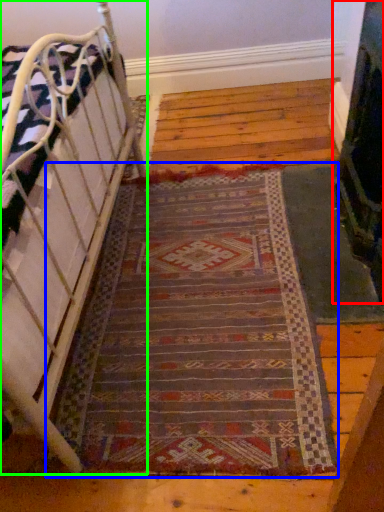
Question: Estimate the real-world distances between objects in this image. Which object is closer to fireplace (highlighted by a red box), mat (highlighted by a blue box) or furniture (highlighted by a green box)?

Choices:
 (A) mat
 (B) furniture

Answer: (A)